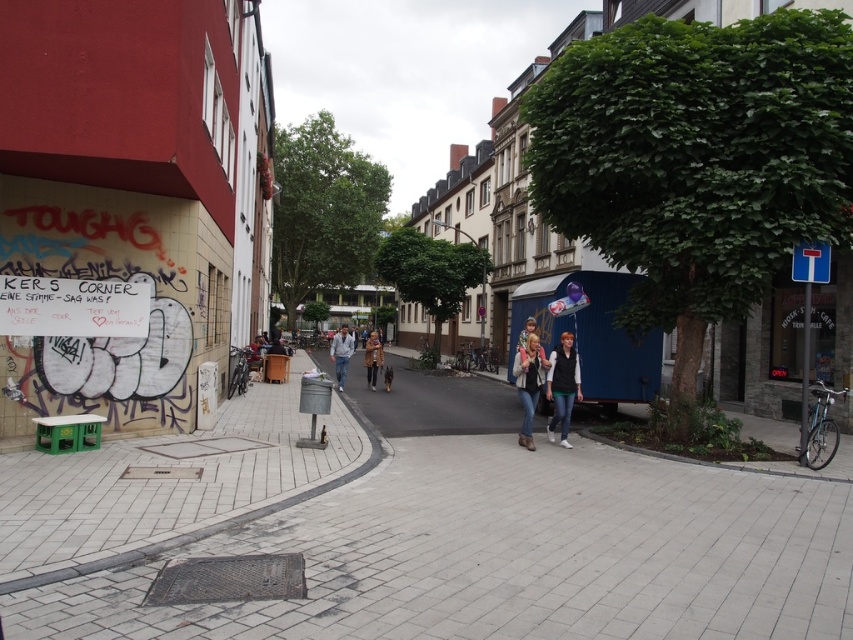
The image size is (853, 640). Describe the element at coordinates (419, 536) in the screenshot. I see `smooth concrete pavement at center` at that location.

Find the location of a particular element. This screenshot has height=640, width=853. smooth concrete pavement at center is located at coordinates (419, 536).

Which is in front, point (90, 513) or point (572, 369)?

Point (90, 513) is more forward.

Where is `smooth concrete pavement at center`? The width and height of the screenshot is (853, 640). smooth concrete pavement at center is located at coordinates (419, 536).

Does light blue jeans at center have a lesser width compared to brown leather jacket at center?

No, light blue jeans at center is not thinner than brown leather jacket at center.

Locate an element on the screen. The height and width of the screenshot is (640, 853). light blue jeans at center is located at coordinates (341, 355).

Image resolution: width=853 pixels, height=640 pixels. What are the coordinates of `light blue jeans at center` in the screenshot? It's located at (341, 355).

Which is below, denim jeans at center or light blue jeans at center?

denim jeans at center is lower down.

Between denim jeans at center and light blue jeans at center, which one appears on the left side from the viewer's perspective?

light blue jeans at center

Between point (521, 371) and point (350, 340), which one is positioned behind?

The point (350, 340) is behind.

You are a GUI agent. You are given a task and a screenshot of the screen. Output one action in this format:
    pyautogui.click(x=<x>, y=<y>)
    Task: Click on the denim jeans at center
    The height and width of the screenshot is (640, 853).
    Given the screenshot: What is the action you would take?
    pyautogui.click(x=527, y=384)